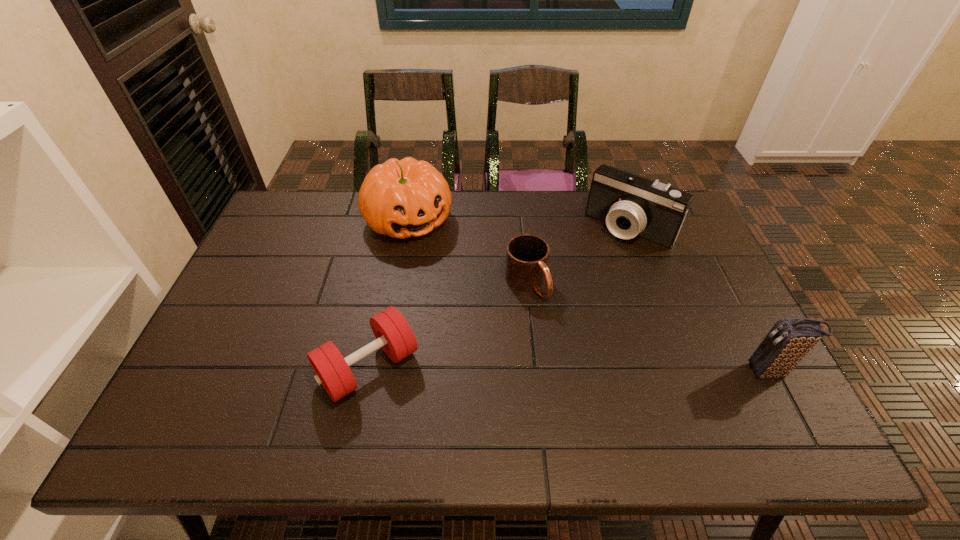
The width and height of the screenshot is (960, 540). I want to click on camcorder located in the far edge section of the desktop, so click(x=631, y=205).

Image resolution: width=960 pixels, height=540 pixels. In order to click on dumbbell situated at the near edge in this screenshot , I will do `click(393, 334)`.

You are a GUI agent. You are given a task and a screenshot of the screen. Output one action in this format:
    pyautogui.click(x=<x>, y=<y>)
    Task: Click on the clutch bag at the near edge
    This screenshot has height=540, width=960.
    Given the screenshot: What is the action you would take?
    pyautogui.click(x=790, y=339)

At what (x,y) coordinates should I click in order to perform the action: click on clutch bag positioned at the right edge. Please return your answer as a coordinate pair (x, y). Looking at the image, I should click on (790, 339).

Image resolution: width=960 pixels, height=540 pixels. I want to click on camcorder that is at the right edge, so click(631, 205).

Locate an element on the screen. Image resolution: width=960 pixels, height=540 pixels. object that is at the far right corner is located at coordinates (631, 205).

Locate an element on the screen. The image size is (960, 540). object located in the near right corner section of the desktop is located at coordinates (790, 339).

This screenshot has width=960, height=540. I want to click on vacant space at the far edge of the desktop, so click(497, 199).

I want to click on vacant space at the near edge, so click(x=672, y=395).

The width and height of the screenshot is (960, 540). In the image, there is a desktop. Find the location of `free space at the left edge`. free space at the left edge is located at coordinates (204, 352).